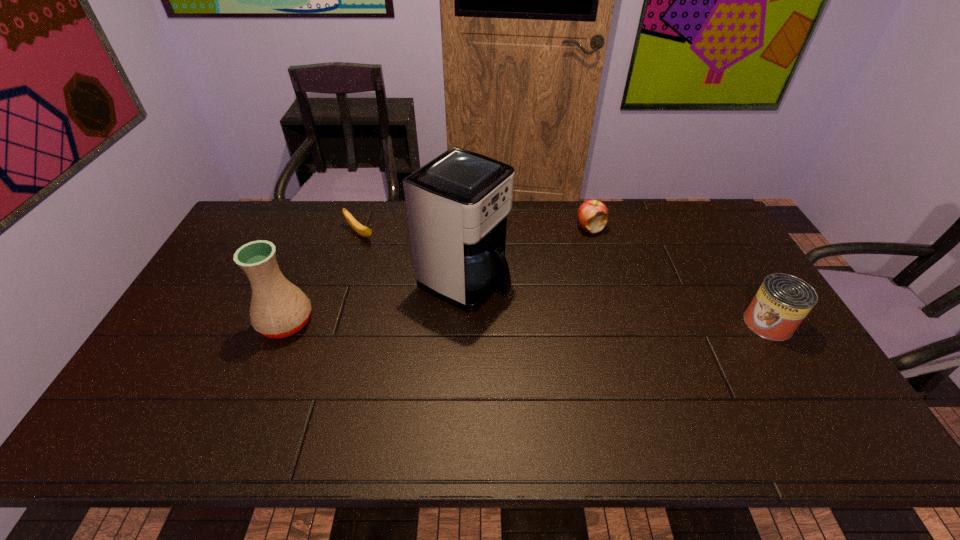
Identify the location of free space located 0.230m on the bitten side of the second object from right to left. The width and height of the screenshot is (960, 540). (566, 279).

Find the location of a particular element. free space located on the bitten side of the second object from right to left is located at coordinates (563, 287).

Locate an element on the screen. The height and width of the screenshot is (540, 960). free space located 0.070m on the bitten side of the second object from right to left is located at coordinates (581, 248).

This screenshot has width=960, height=540. In order to click on vacant space situated at the stem of the shortest object in this screenshot , I will do `click(392, 256)`.

In order to click on blank space located at the stem of the shortest object in this screenshot , I will do `click(408, 268)`.

In order to click on free point located at the stem of the shortest object in this screenshot , I will do `click(418, 275)`.

You are a GUI agent. You are given a task and a screenshot of the screen. Output one action in this format:
    pyautogui.click(x=<x>, y=<y>)
    Task: Click on the vacant position located on the front panel of the third object from right to left
    This screenshot has width=960, height=540.
    Given the screenshot: What is the action you would take?
    pyautogui.click(x=535, y=314)

At what (x,y) coordinates should I click in order to perform the action: click on free spot located on the front panel of the third object from right to left. Please return your answer as a coordinate pair (x, y). Looking at the image, I should click on (629, 359).

Where is `free space located on the front panel of the third object from right to left`? free space located on the front panel of the third object from right to left is located at coordinates (576, 334).

Where is `apple located in the far edge section of the desktop`? Image resolution: width=960 pixels, height=540 pixels. apple located in the far edge section of the desktop is located at coordinates (592, 215).